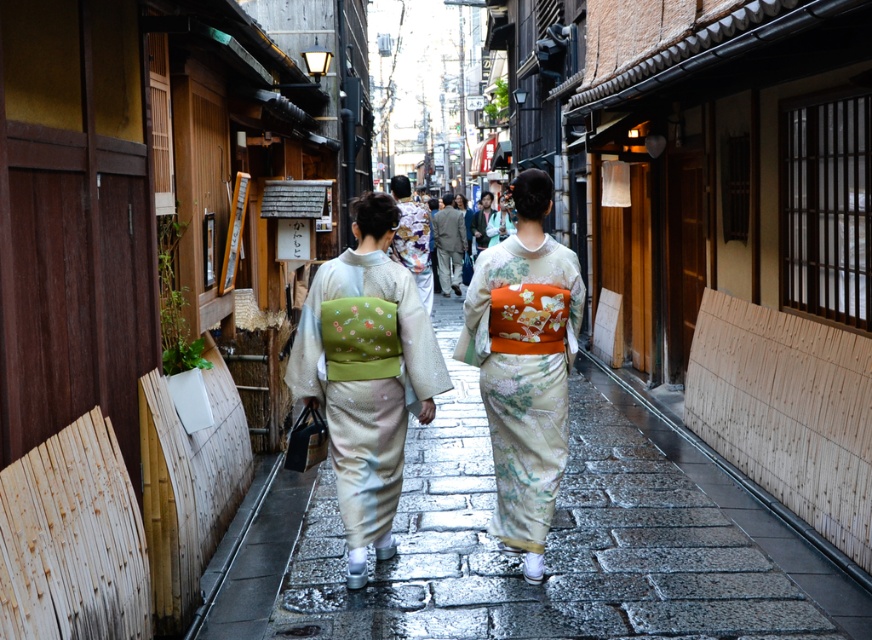
Question: Can you confirm if matte green kimono at center is bigger than silky white kimono at center?

Choices:
 (A) yes
 (B) no

Answer: (B)

Question: Does matte green kimono at center appear over silky white kimono at center?

Choices:
 (A) yes
 (B) no

Answer: (B)

Question: Estimate the real-world distances between objects in this image. Which object is closer to the matte green kimono at center?

Choices:
 (A) silky white kimono at center
 (B) smooth stone pavement at center

Answer: (A)

Question: Can you confirm if smooth stone pavement at center is thinner than matte green kimono at center?

Choices:
 (A) yes
 (B) no

Answer: (A)

Question: Which of the following is the farthest from the observer?

Choices:
 (A) smooth stone pavement at center
 (B) silky white kimono at center

Answer: (A)

Question: Which point is farther to the camera?

Choices:
 (A) silky white kimono at center
 (B) matte green kimono at center

Answer: (A)